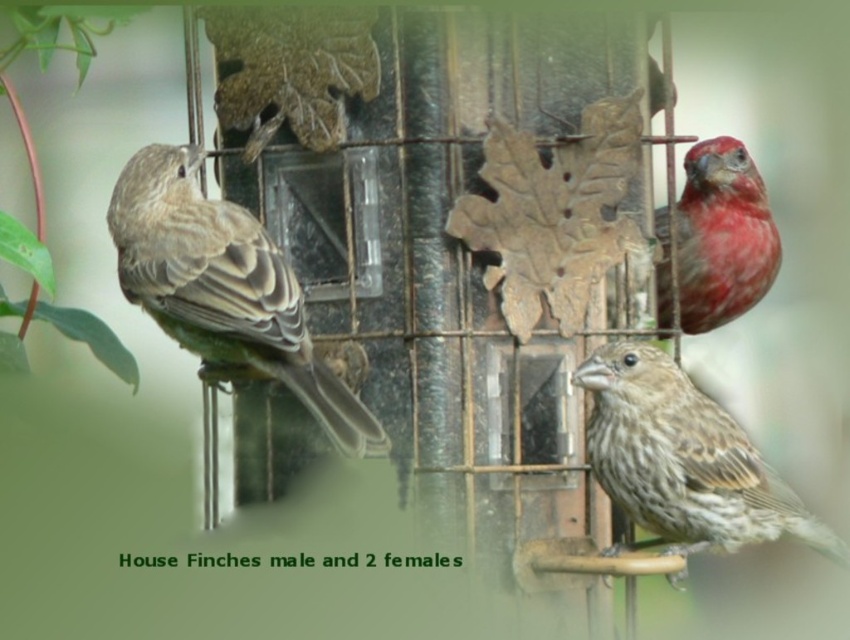
Question: Is brown speckled sparrow at left further to camera compared to brown speckled sparrow at lower right?

Choices:
 (A) yes
 (B) no

Answer: (B)

Question: Can you confirm if brown speckled sparrow at left is wider than matte red finch at upper right?

Choices:
 (A) yes
 (B) no

Answer: (A)

Question: Is brown speckled sparrow at lower right positioned at the back of matte red finch at upper right?

Choices:
 (A) no
 (B) yes

Answer: (A)

Question: Which object is closer to the camera taking this photo?

Choices:
 (A) matte red finch at upper right
 (B) brown speckled sparrow at left

Answer: (B)

Question: Considering the real-world distances, which object is farthest from the matte red finch at upper right?

Choices:
 (A) brown speckled sparrow at left
 (B) brown speckled sparrow at lower right

Answer: (A)

Question: Considering the real-world distances, which object is closest to the brown speckled sparrow at lower right?

Choices:
 (A) matte red finch at upper right
 (B) brown speckled sparrow at left

Answer: (A)